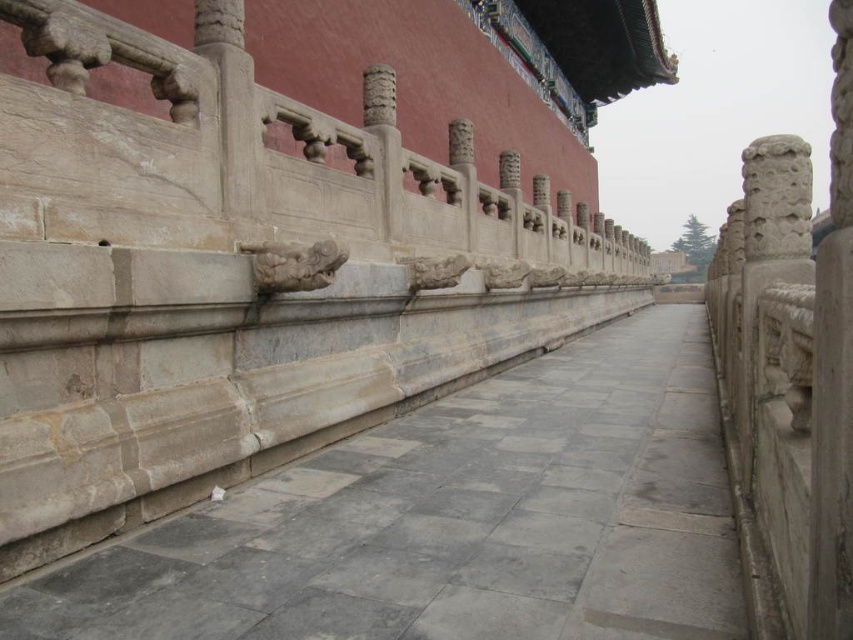
Question: Can you confirm if gray stone path at center is positioned above gray stone railing at center?

Choices:
 (A) no
 (B) yes

Answer: (A)

Question: Which point is closer to the camera taking this photo?

Choices:
 (A) coord(659,477)
 (B) coord(498,227)

Answer: (A)

Question: Can you confirm if gray stone path at center is thinner than gray stone railing at center?

Choices:
 (A) yes
 (B) no

Answer: (A)

Question: Is gray stone path at center bigger than gray stone railing at center?

Choices:
 (A) yes
 (B) no

Answer: (B)